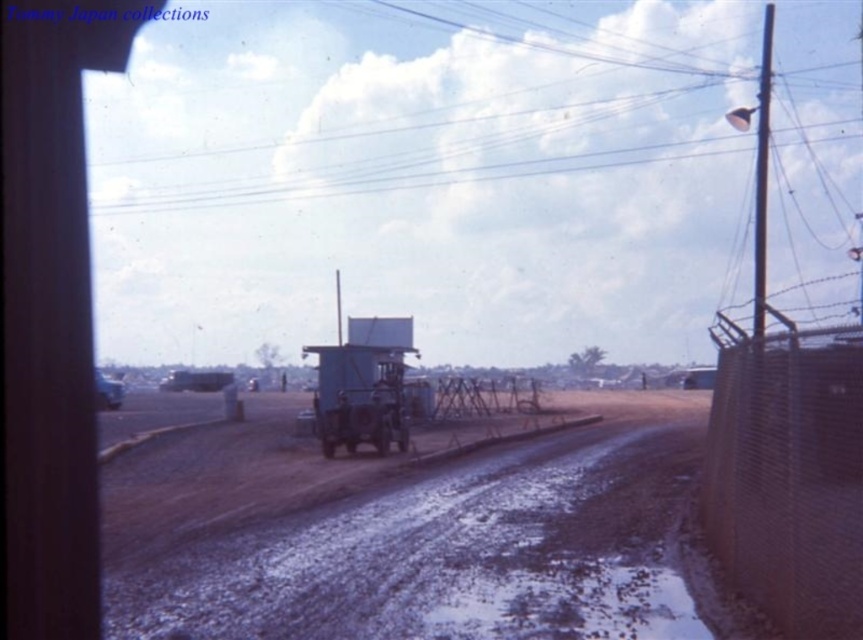
Who is positioned more to the left, brown dirt track at center or rusty wire mesh fence at right?

Positioned to the left is brown dirt track at center.

Does point (385, 545) come closer to viewer compared to point (802, 353)?

No, it is not.

Locate an element on the screen. This screenshot has height=640, width=863. brown dirt track at center is located at coordinates tap(405, 532).